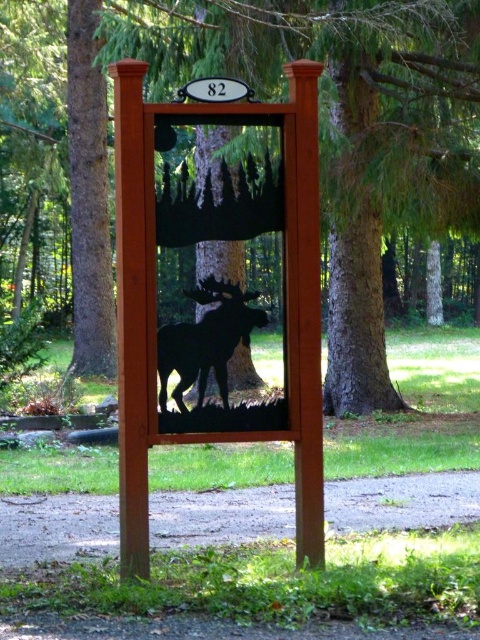
Question: Which point is farther to the camera?

Choices:
 (A) (239, 326)
 (B) (123, 252)
 (C) (333, 380)

Answer: (C)

Question: Is brown wood tree at center positioned behind matte wood sign at center?

Choices:
 (A) yes
 (B) no

Answer: (A)

Question: Considering the relative positions of matte wood sign at center and black matte moose at center in the image provided, where is matte wood sign at center located with respect to black matte moose at center?

Choices:
 (A) above
 (B) below

Answer: (A)

Question: Based on their relative distances, which object is nearer to the brown wood tree at center?

Choices:
 (A) black matte moose at center
 (B) matte wood sign at center

Answer: (B)

Question: Can you confirm if matte wood sign at center is bigger than black matte moose at center?

Choices:
 (A) yes
 (B) no

Answer: (A)

Question: Which is farther from the matte wood sign at center?

Choices:
 (A) brown wood tree at center
 (B) black matte moose at center

Answer: (A)